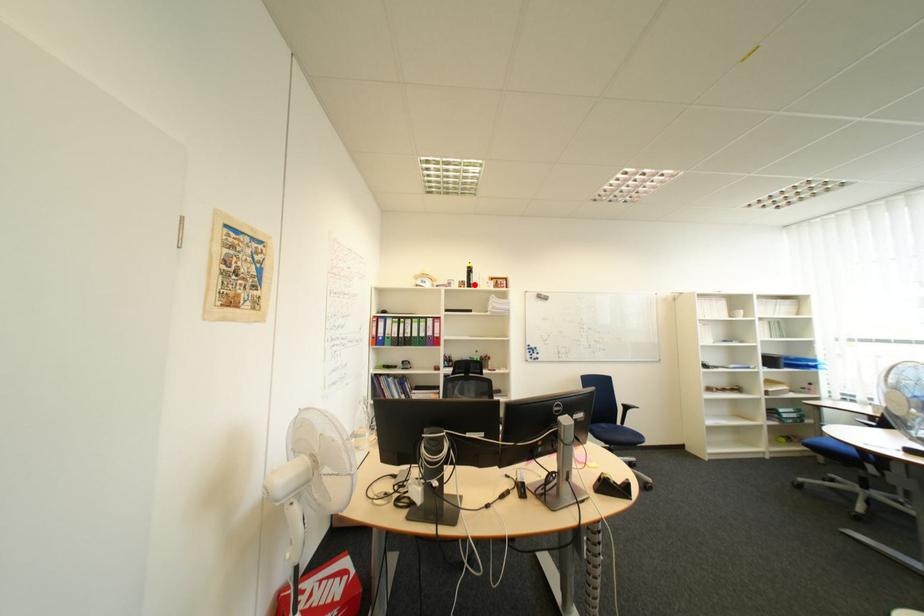
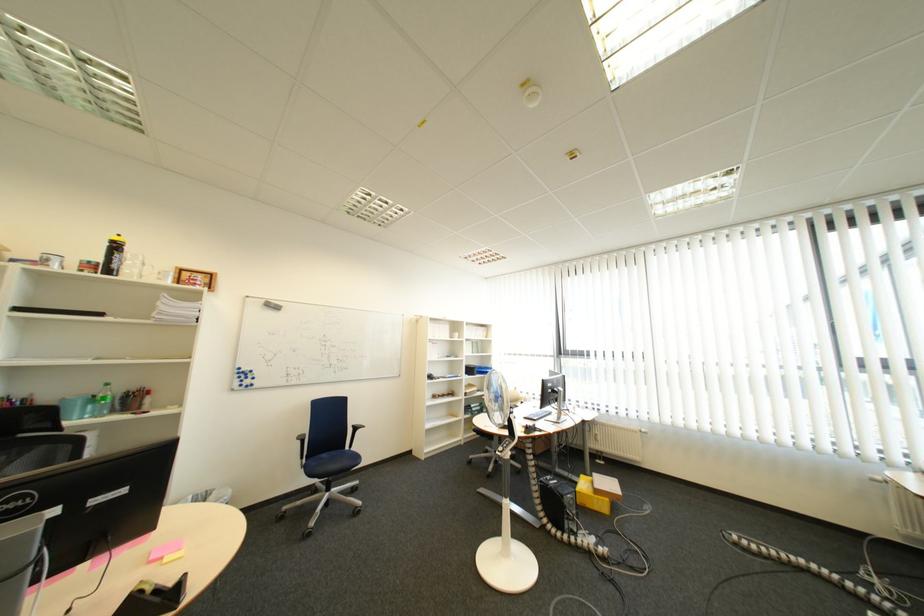
Locate, in the second image, the point that corresponds to the highlighted location in the first image.

(102, 267)